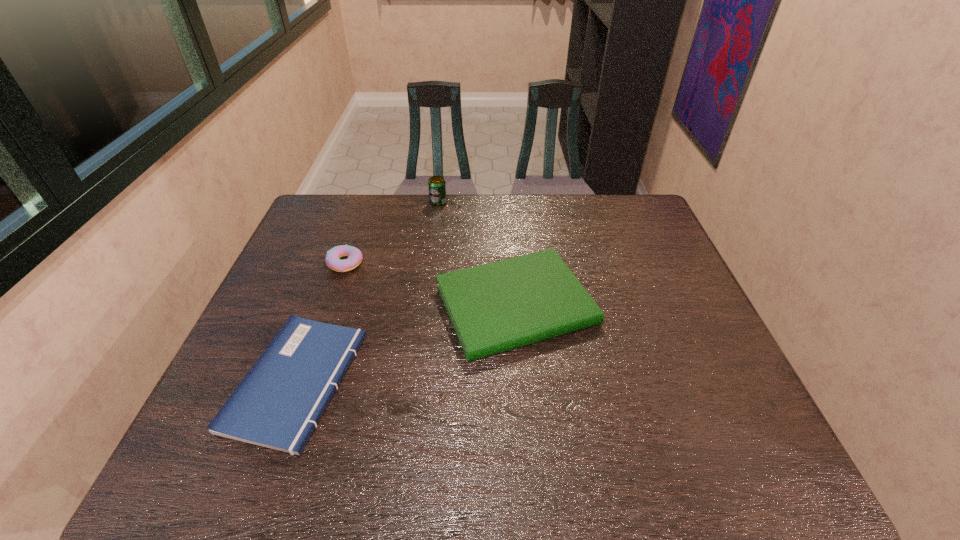
Where is `object that is at the far edge`? The width and height of the screenshot is (960, 540). object that is at the far edge is located at coordinates (436, 185).

Locate an element on the screen. object that is at the near edge is located at coordinates (278, 404).

The image size is (960, 540). In order to click on doughnut that is at the left edge in this screenshot , I will do `click(354, 255)`.

The image size is (960, 540). Identify the location of paperback book that is at the left edge. (278, 404).

Locate an element on the screen. The width and height of the screenshot is (960, 540). object that is at the near left corner is located at coordinates point(278,404).

Where is `vacant space at the far edge of the desktop`? vacant space at the far edge of the desktop is located at coordinates (583, 210).

Image resolution: width=960 pixels, height=540 pixels. Identify the location of vacant area at the near edge of the desktop. (608, 483).

The height and width of the screenshot is (540, 960). What are the coordinates of `free region at the left edge of the desktop` in the screenshot? It's located at point(306,289).

Locate an element on the screen. vacant point at the right edge is located at coordinates (655, 349).

The height and width of the screenshot is (540, 960). What are the coordinates of `blank area at the far left corner` in the screenshot? It's located at (325, 199).